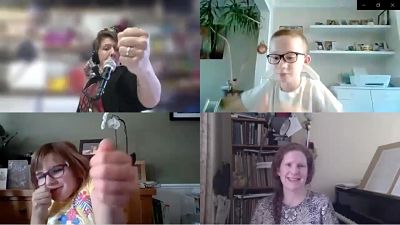
This screenshot has height=225, width=400. In order to click on piano in this screenshot , I will do `click(357, 201)`.